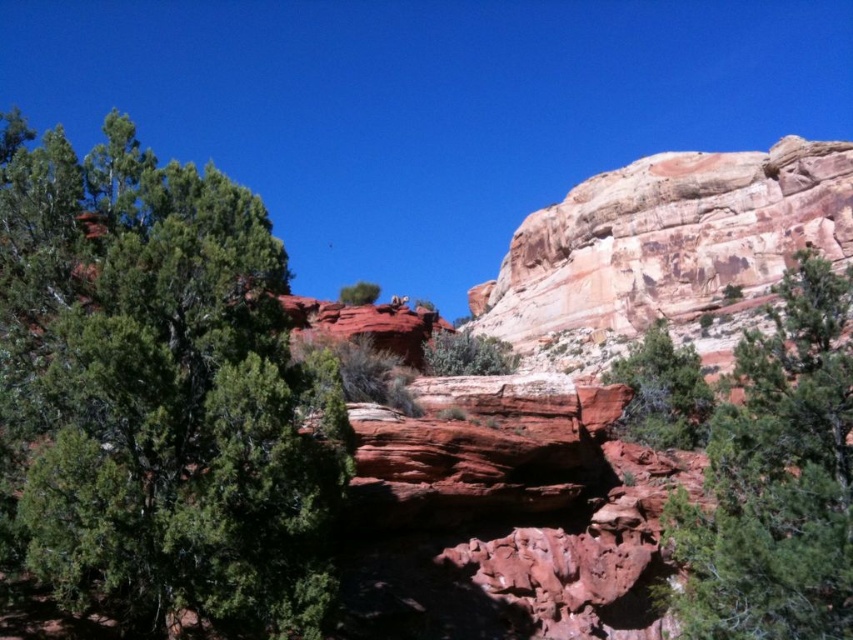
You are standing at the point marked as point (776, 477) in the image. What object are you facing?

The point (776, 477) corresponds to the green textured tree at center, so you are facing the green textured tree at center.

You are standing at the base of the rock formations in the image and notice a specific point marked at coordinates [776,477]. Based on the scene description, what object does this point correspond to?

The point at coordinates [776,477] corresponds to the green textured tree at center.

You are an explorer trying to navigate through the rocks to reach the green matte tree at center. There is a green leafy tree at upper left blocking your path. Which tree should you move around to get to your destination?

You should move around the green leafy tree at upper left since it is positioned on the left side of the green matte tree at center, so going around it would allow you to reach the green matte tree at center.